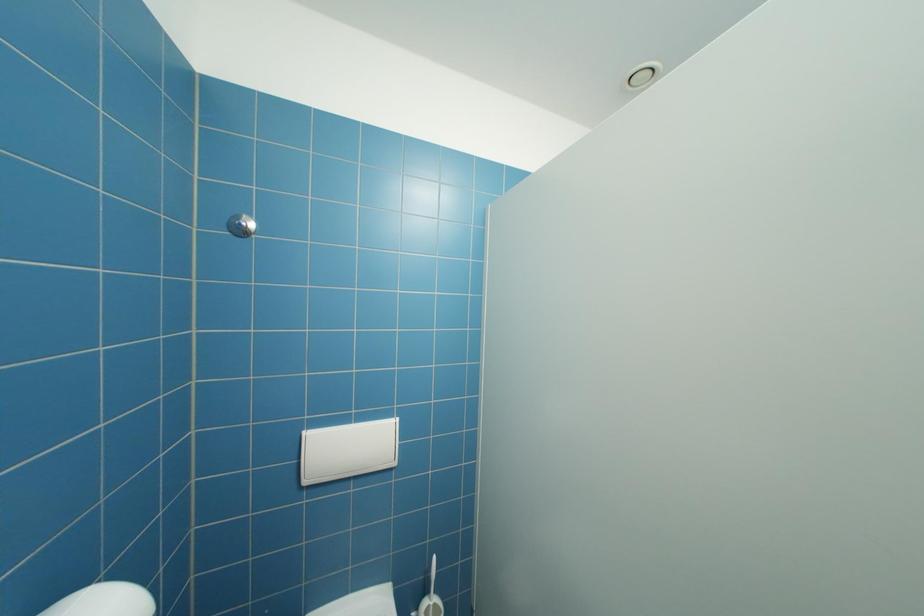
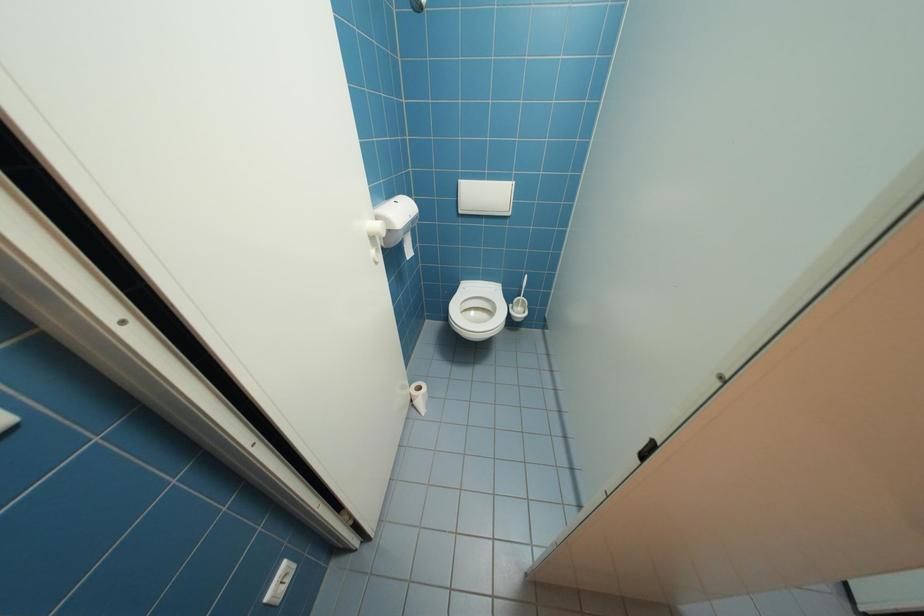
How did the camera likely rotate?

The camera's rotation is toward left-down.